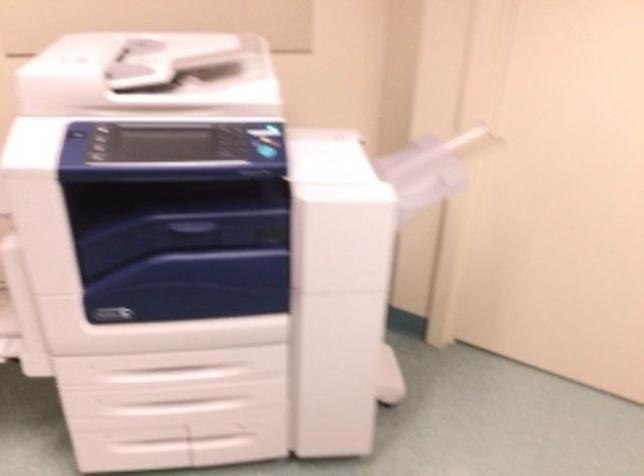
What do you see at coordinates (232, 150) in the screenshot? Image resolution: width=644 pixels, height=476 pixels. I see `the printer control buttons` at bounding box center [232, 150].